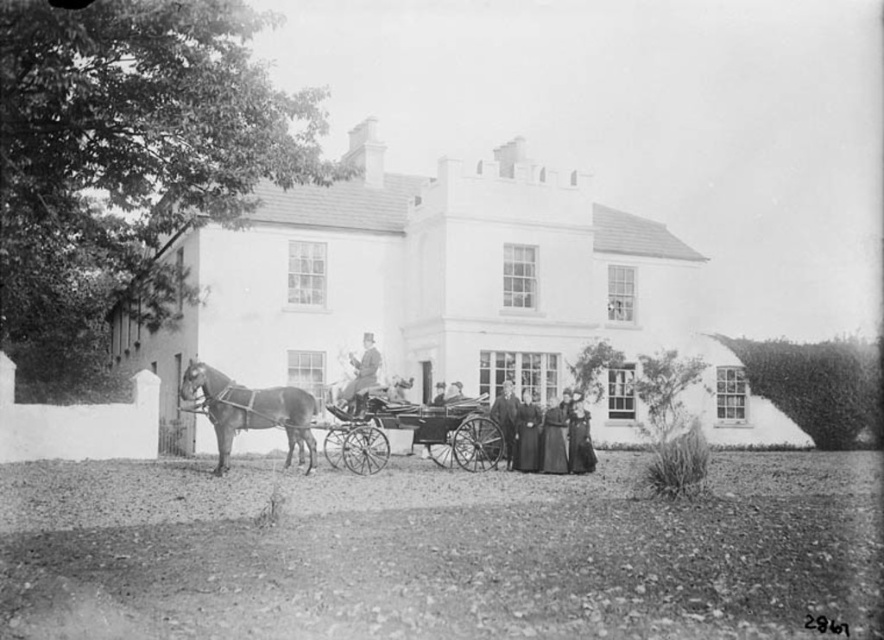
Is wooden polished cart at center above dark wool coat at center?

Yes.

Does wooden polished cart at center have a greater width compared to dark wool coat at center?

Yes.

Between point (332, 412) and point (532, 442), which one is positioned behind?

Point (532, 442)

Locate an element on the screen. This screenshot has width=884, height=640. wooden polished cart at center is located at coordinates (437, 428).

Is point (277, 396) farther from camera compared to point (531, 424)?

No.

Which is below, brown leather horse at lower left or dark wool coat at center?

Positioned lower is dark wool coat at center.

From the picture: Who is more forward, (x=207, y=371) or (x=513, y=461)?

Point (x=207, y=371)

Image resolution: width=884 pixels, height=640 pixels. In order to click on brown leather horse at lower left in this screenshot , I will do `click(250, 412)`.

Does dark wool coat at center have a lesser width compared to smooth dark fabric coat at center?

In fact, dark wool coat at center might be wider than smooth dark fabric coat at center.

Can you confirm if dark wool coat at center is shorter than smooth dark fabric coat at center?

Yes, dark wool coat at center is shorter than smooth dark fabric coat at center.

You are a GUI agent. You are given a task and a screenshot of the screen. Output one action in this format:
    pyautogui.click(x=<x>, y=<y>)
    Task: Click on the dark wool coat at center
    
    Given the screenshot: What is the action you would take?
    pyautogui.click(x=527, y=435)